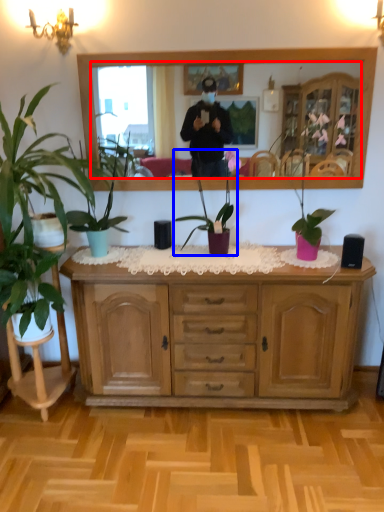
Question: Among these objects, which one is nearest to the camera, mirror (highlighted by a red box) or houseplant (highlighted by a blue box)?

Choices:
 (A) mirror
 (B) houseplant

Answer: (B)